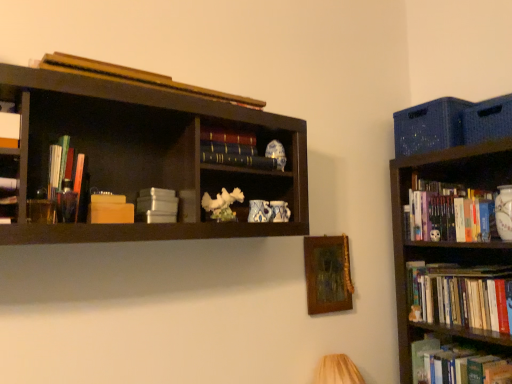
What is the approximate width of matte orange paperback book at left?

The width of matte orange paperback book at left is 2.89 inches.

The image size is (512, 384). What do you see at coordinates (448, 214) in the screenshot? I see `hardcover books at right, arranged as the third book when viewed from the right` at bounding box center [448, 214].

What is the approximate height of wooden picture frame at center?

wooden picture frame at center is 13.83 inches tall.

What is the approximate height of hardcover book at center, which is the 6th book in bottom-to-top order?

hardcover book at center, which is the 6th book in bottom-to-top order, is 2.28 inches tall.

How much space does translucent plastic pens at left, the fourth book in the top-to-bottom sequence, occupy vertically?

translucent plastic pens at left, the fourth book in the top-to-bottom sequence, is 9.38 inches in height.

Consider the image. Measure the distance between translucent plastic pens at left, the fourth book in the top-to-bottom sequence, and camera.

translucent plastic pens at left, the fourth book in the top-to-bottom sequence, is 3.62 feet away from camera.

Describe the element at coordinates (12, 185) in the screenshot. I see `matte black bookshelf at left` at that location.

Where is `matte orange paperback book at left`? The width and height of the screenshot is (512, 384). matte orange paperback book at left is located at coordinates (111, 213).

Which is farther, (414, 347) or (147, 213)?

The point (414, 347) is farther from the camera.

Would you say hardcover book at lower right, the first book from the bottom, is to the left or to the right of white matte stack of boxes at center-left, which appears as the sixth book when viewed from the right, in the picture?

hardcover book at lower right, the first book from the bottom, is to the right of white matte stack of boxes at center-left, which appears as the sixth book when viewed from the right.

Can you tell me how much hardcover book at lower right, the first book from the bottom, and white matte stack of boxes at center-left, the fifth book from the top, differ in facing direction?

The angle between the facing direction of hardcover book at lower right, the first book from the bottom, and the facing direction of white matte stack of boxes at center-left, the fifth book from the top, is 94.2 degrees.

Which object is thinner, hardcover book at lower right, which is the eighth book from top to bottom, or white matte stack of boxes at center-left, the fifth book from the top?

white matte stack of boxes at center-left, the fifth book from the top, is thinner.

Are matte black bookshelf at left and hardcover book at center, which is the 6th book in bottom-to-top order, beside each other?

matte black bookshelf at left and hardcover book at center, which is the 6th book in bottom-to-top order, are clearly separated.

Is matte black bookshelf at left oriented away from hardcover book at center, which is the 5th book in left-to-right order?

No, matte black bookshelf at left's orientation is not away from hardcover book at center, which is the 5th book in left-to-right order.

Does matte black bookshelf at left come in front of hardcover book at center, which is the 5th book in left-to-right order?

Yes, matte black bookshelf at left is in front of hardcover book at center, which is the 5th book in left-to-right order.

Which of these two, matte black bookshelf at left or hardcover book at center, the fourth book viewed from the right, is bigger?

matte black bookshelf at left is bigger.

Who is taller, white matte book at upper left, marked as the seventh book in a bottom-to-top arrangement, or matte orange paperback book at left?

white matte book at upper left, marked as the seventh book in a bottom-to-top arrangement.

Which of these two, white matte book at upper left, marked as the seventh book in a bottom-to-top arrangement, or matte orange paperback book at left, is wider?

white matte book at upper left, marked as the seventh book in a bottom-to-top arrangement, is wider.

Between white matte book at upper left, which is the eighth book from right to left, and matte orange paperback book at left, which one appears on the left side from the viewer's perspective?

From the viewer's perspective, white matte book at upper left, which is the eighth book from right to left, appears more on the left side.

Which object is further away from the camera, white matte book at upper left, acting as the second book starting from the top, or matte orange paperback book at left?

matte orange paperback book at left is further from the camera.

From a real-world perspective, who is located lower, translucent plastic pens at left, arranged as the second book when viewed from the left, or white matte book at upper left, marked as the seventh book in a bottom-to-top arrangement?

From a 3D spatial view, translucent plastic pens at left, arranged as the second book when viewed from the left, is below.

Can white matte book at upper left, acting as the first book starting from the left, be found inside translucent plastic pens at left, the fifth book when ordered from bottom to top?

No, white matte book at upper left, acting as the first book starting from the left, is not surrounded by translucent plastic pens at left, the fifth book when ordered from bottom to top.

Is point (64, 138) more distant than point (10, 136)?

Yes, point (64, 138) is behind point (10, 136).

From the image's perspective, is translucent plastic pens at left, the fifth book when ordered from bottom to top, beneath white matte book at upper left, which is the eighth book from right to left?

Yes, from the image's perspective, translucent plastic pens at left, the fifth book when ordered from bottom to top, is below white matte book at upper left, which is the eighth book from right to left.

Does point (418, 263) lie behind point (78, 194)?

Yes.

How different are the orientations of hardcover books at right, positioned as the second book in bottom-to-top order, and translucent plastic pens at left, arranged as the 7th book when viewed from the right, in degrees?

The facing directions of hardcover books at right, positioned as the second book in bottom-to-top order, and translucent plastic pens at left, arranged as the 7th book when viewed from the right, are 94.2 degrees apart.

The height and width of the screenshot is (384, 512). In order to click on the 6th book counting from the right of the translucent plastic pens at left, arranged as the second book when viewed from the left in this screenshot , I will do `click(461, 295)`.

Based on the photo, which object is positioned more to the right, hardcover books at right, which is counted as the first book, starting from the right, or translucent plastic pens at left, arranged as the second book when viewed from the left?

From the viewer's perspective, hardcover books at right, which is counted as the first book, starting from the right, appears more on the right side.

How many degrees apart are the facing directions of hardcover books at right, the third book in the bottom-to-top sequence, and wooden book at upper center, the 1th book when ordered from top to bottom?

The angular difference between hardcover books at right, the third book in the bottom-to-top sequence, and wooden book at upper center, the 1th book when ordered from top to bottom, is 91.9 degrees.

Is hardcover books at right, the third book in the bottom-to-top sequence, next to wooden book at upper center, which is counted as the 4th book, starting from the left?

There is a gap between hardcover books at right, the third book in the bottom-to-top sequence, and wooden book at upper center, which is counted as the 4th book, starting from the left.

Is hardcover books at right, positioned as the sixth book in top-to-bottom order, not inside wooden book at upper center, which is counted as the 4th book, starting from the left?

Indeed, hardcover books at right, positioned as the sixth book in top-to-bottom order, is completely outside wooden book at upper center, which is counted as the 4th book, starting from the left.

From the picture: Is hardcover books at right, the 6th book in the left-to-right sequence, bigger than wooden book at upper center, which appears as the 5th book when viewed from the right?

Yes, hardcover books at right, the 6th book in the left-to-right sequence, is bigger than wooden book at upper center, which appears as the 5th book when viewed from the right.

Considering the sizes of objects hardcover book at center, the fourth book viewed from the right, and matte black bookshelf at left in the image provided, who is wider, hardcover book at center, the fourth book viewed from the right, or matte black bookshelf at left?

matte black bookshelf at left.

From a real-world perspective, is hardcover book at center, which is the 6th book in bottom-to-top order, physically located above or below matte black bookshelf at left?

In terms of real-world spatial position, hardcover book at center, which is the 6th book in bottom-to-top order, is above matte black bookshelf at left.

Is hardcover book at center, the fourth book viewed from the right, next to matte black bookshelf at left and touching it?

No, hardcover book at center, the fourth book viewed from the right, is not with matte black bookshelf at left.

Considering the relative sizes of hardcover book at center, which is the third book in top-to-bottom order, and matte black bookshelf at left in the image provided, is hardcover book at center, which is the third book in top-to-bottom order, taller than matte black bookshelf at left?

No, hardcover book at center, which is the third book in top-to-bottom order, is not taller than matte black bookshelf at left.

Which book is the 3rd one when counting from the back of the white matte stack of boxes at center-left, which appears as the sixth book when viewed from the right? Please provide its 2D coordinates.

[(448, 362)]

Where is `the 2nd book above the matte black bookshelf at left (from the image's perspective)`? This screenshot has width=512, height=384. the 2nd book above the matte black bookshelf at left (from the image's perspective) is located at coordinates (239, 160).

Looking at the image, which one is located closer to white matte stack of boxes at center-left, which appears as the sixth book when viewed from the right, hardcover books at right, the third book in the bottom-to-top sequence, or wooden book at upper center, which appears as the 5th book when viewed from the right?

wooden book at upper center, which appears as the 5th book when viewed from the right, is closer to white matte stack of boxes at center-left, which appears as the sixth book when viewed from the right.

Considering their positions, is white matte book at upper left, which is the eighth book from right to left, positioned closer to white matte stack of boxes at center-left, which ranks as the 4th book in bottom-to-top order, than translucent plastic pens at left, the fourth book in the top-to-bottom sequence?

Based on the image, translucent plastic pens at left, the fourth book in the top-to-bottom sequence, appears to be nearer to white matte stack of boxes at center-left, which ranks as the 4th book in bottom-to-top order.

From the image, which object appears to be farther from wooden picture frame at center, white matte book at upper left, which is the eighth book from right to left, or hardcover books at right, arranged as the third book when viewed from the right?

Based on the image, white matte book at upper left, which is the eighth book from right to left, appears to be further to wooden picture frame at center.

From the image, which object appears to be nearer to hardcover book at center, the fourth book viewed from the right, hardcover books at right, which is counted as the first book, starting from the right, or white matte book at upper left, marked as the seventh book in a bottom-to-top arrangement?

Based on the image, white matte book at upper left, marked as the seventh book in a bottom-to-top arrangement, appears to be nearer to hardcover book at center, the fourth book viewed from the right.

Estimate the real-world distances between objects in this image. Which object is closer to wooden book at upper center, the 1th book when ordered from top to bottom, white matte book at upper left, acting as the first book starting from the left, or white matte stack of boxes at center-left, which ranks as the 4th book in bottom-to-top order?

white matte book at upper left, acting as the first book starting from the left, lies closer to wooden book at upper center, the 1th book when ordered from top to bottom, than the other object.

Estimate the real-world distances between objects in this image. Which object is closer to matte orange paperback book at left, translucent plastic pens at left, arranged as the second book when viewed from the left, or hardcover books at right, arranged as the third book when viewed from the right?

translucent plastic pens at left, arranged as the second book when viewed from the left, is closer to matte orange paperback book at left.

Considering their positions, is matte black bookshelf at left positioned closer to matte orange paperback book at left than hardcover books at right, the third book in the bottom-to-top sequence?

matte black bookshelf at left lies closer to matte orange paperback book at left than the other object.

When comparing their distances from wooden book at upper center, the 8th book in the bottom-to-top sequence, does hardcover books at right, which appears as the 7th book when viewed from the top, or matte orange paperback book at left seem closer?

matte orange paperback book at left is positioned closer to the anchor wooden book at upper center, the 8th book in the bottom-to-top sequence.

Where is `paperback book between white matte book at upper left, marked as the seventh book in a bottom-to-top arrangement, and hardcover book at center, which is the 6th book in bottom-to-top order, in the horizontal direction`? The height and width of the screenshot is (384, 512). paperback book between white matte book at upper left, marked as the seventh book in a bottom-to-top arrangement, and hardcover book at center, which is the 6th book in bottom-to-top order, in the horizontal direction is located at coordinates (111, 213).

At what (x,y) coordinates should I click in order to perform the action: click on paperback book located between matte black bookshelf at left and hardcover book at center, which is the third book in top-to-bottom order, in the left-right direction. Please return your answer as a coordinate pair (x, y). Looking at the image, I should click on (111, 213).

Identify the location of picture frame between hardcover book at center, which is the third book in top-to-bottom order, and hardcover books at right, arranged as the third book when viewed from the right, in the horizontal direction. (327, 274).

You are a GUI agent. You are given a task and a screenshot of the screen. Output one action in this format:
    pyautogui.click(x=<x>, y=<y>)
    Task: Click on the picture frame between white matte book at upper left, which is the eighth book from right to left, and hardcover books at right, positioned as the second book in bottom-to-top order, from left to right
    The image size is (512, 384).
    Given the screenshot: What is the action you would take?
    pyautogui.click(x=327, y=274)